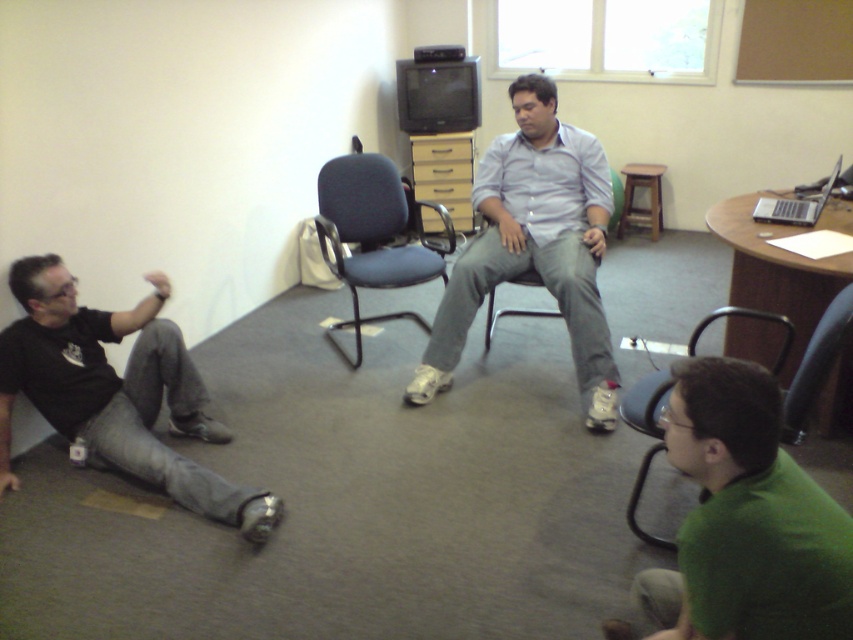
Question: Which of the following is the farthest from the observer?

Choices:
 (A) (733, 577)
 (B) (653, 225)

Answer: (B)

Question: Observing the image, what is the correct spatial positioning of light blue shirt at center in reference to matte blue chair at center?

Choices:
 (A) right
 (B) left

Answer: (B)

Question: Which object appears closest to the camera in this image?

Choices:
 (A) black matte shirt at lower left
 (B) light blue shirt at center
 (C) blue fabric chair at center

Answer: (A)

Question: Is green matte shirt at lower right behind black matte shirt at lower left?

Choices:
 (A) yes
 (B) no

Answer: (B)

Question: Considering the relative positions of green matte shirt at lower right and wooden stool at center in the image provided, where is green matte shirt at lower right located with respect to wooden stool at center?

Choices:
 (A) below
 (B) above

Answer: (A)

Question: Which of the following is the closest to the observer?

Choices:
 (A) (770, 605)
 (B) (614, 189)
 (C) (15, 476)
 (D) (361, 243)

Answer: (A)